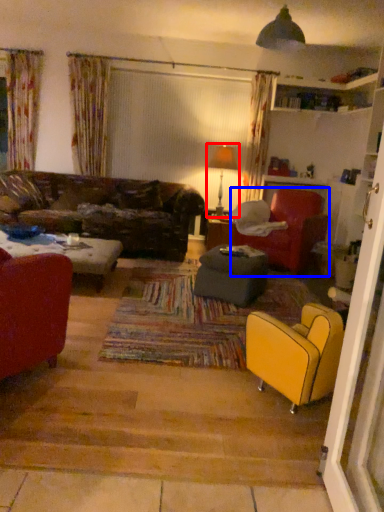
Question: Which point is closer to the camera, lamp (highlighted by a red box) or chair (highlighted by a blue box)?

Choices:
 (A) lamp
 (B) chair

Answer: (B)